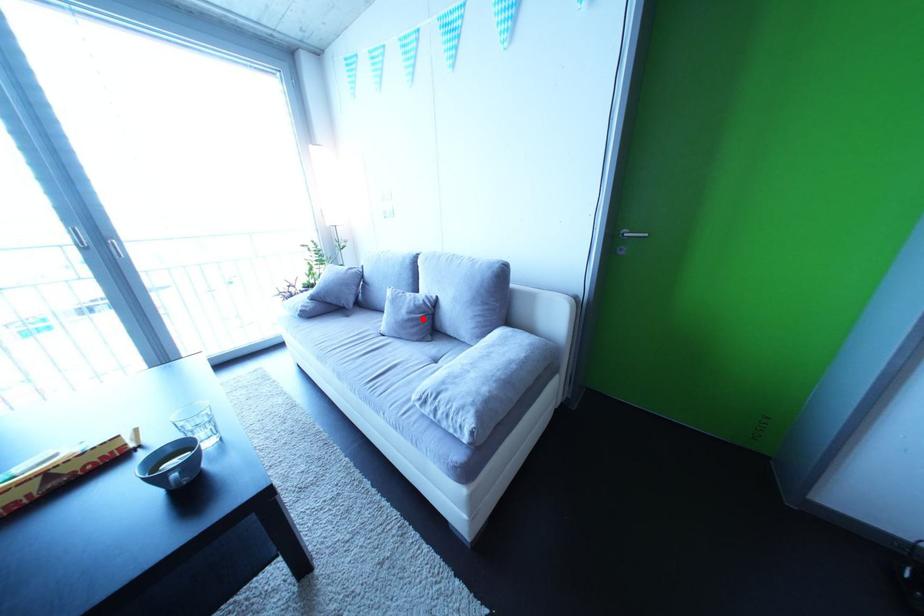
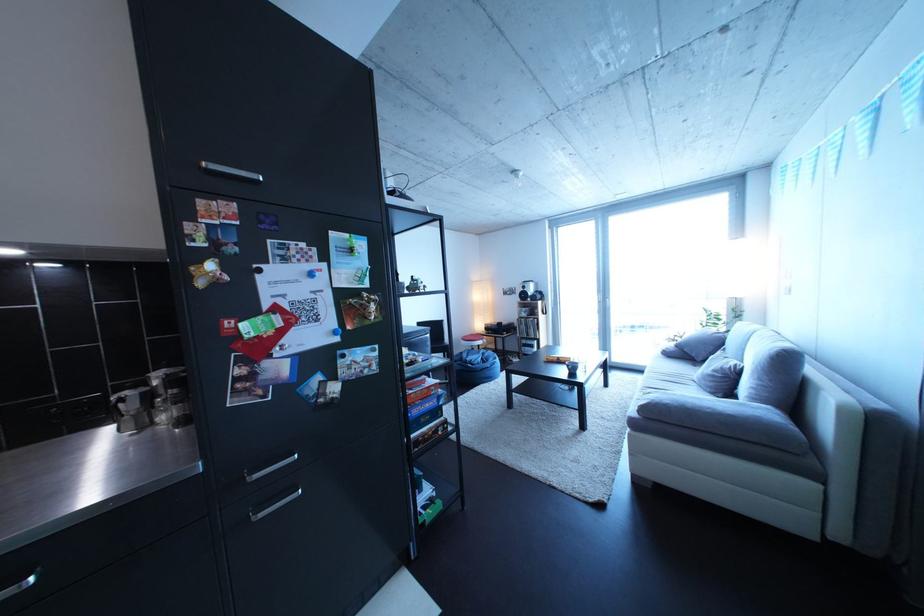
Locate, in the second image, the point that corresponds to the highlighted location in the first image.

(727, 377)